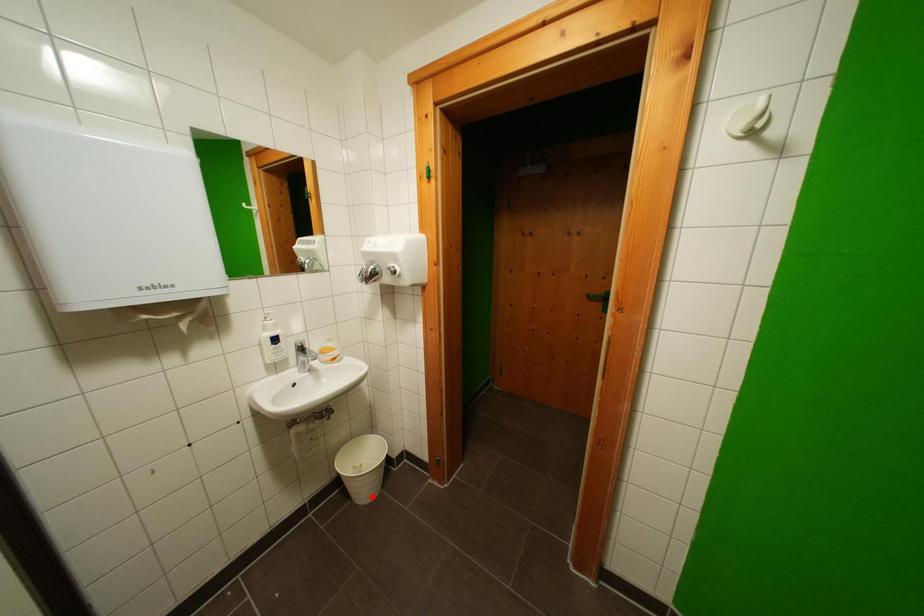
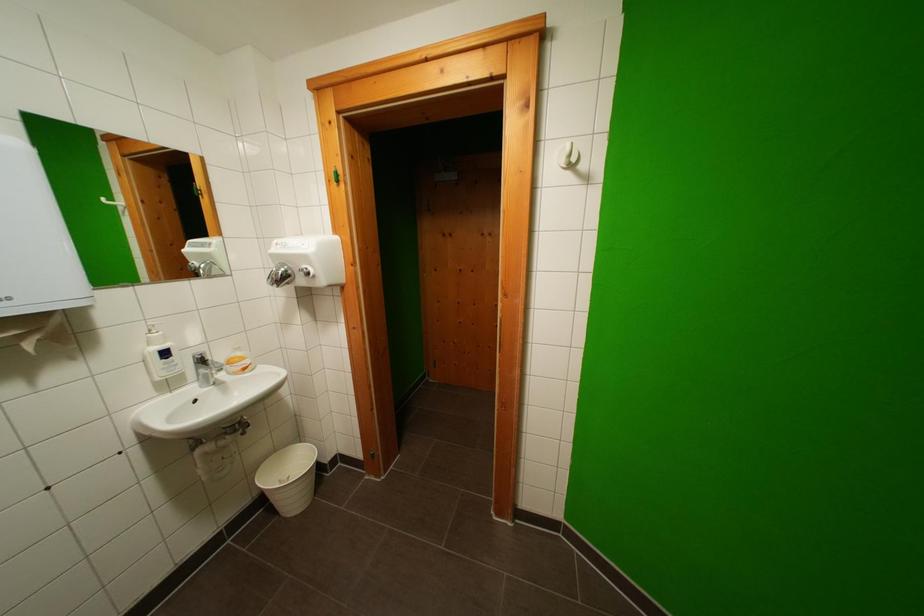
The point at the highlighted location is marked in the first image. Where is the corresponding point in the second image?

(301, 507)